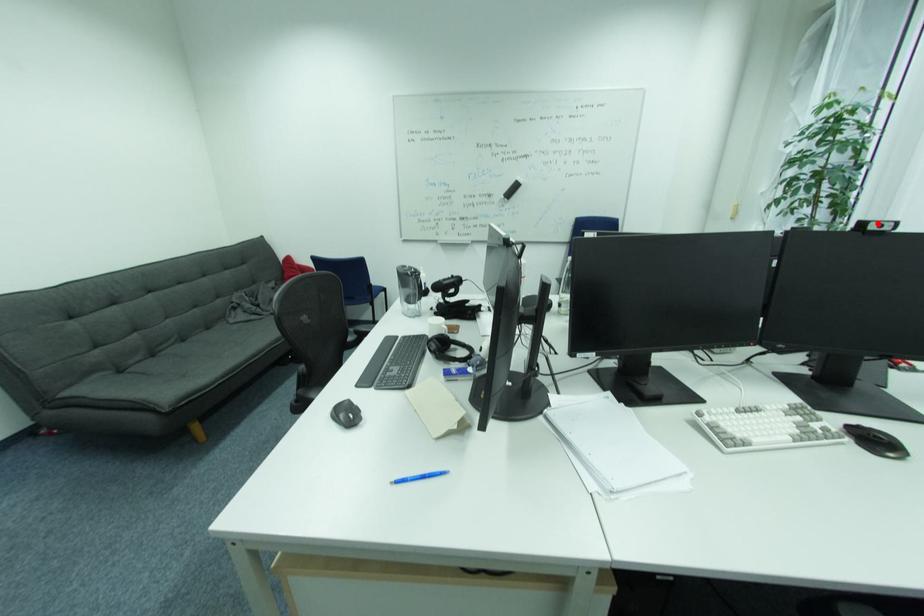
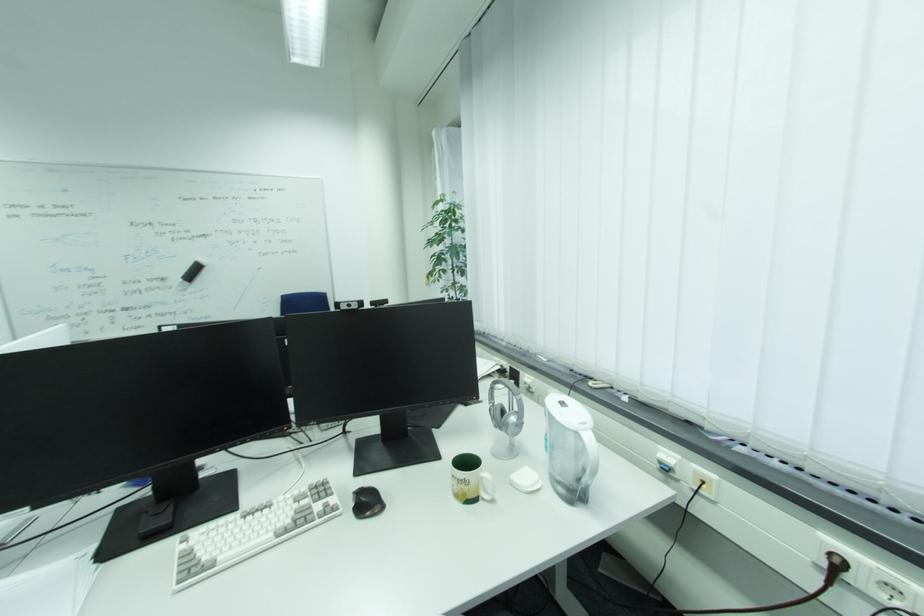
Where in the second image is the point corresponding to the highlighted location from the first image?

(348, 304)